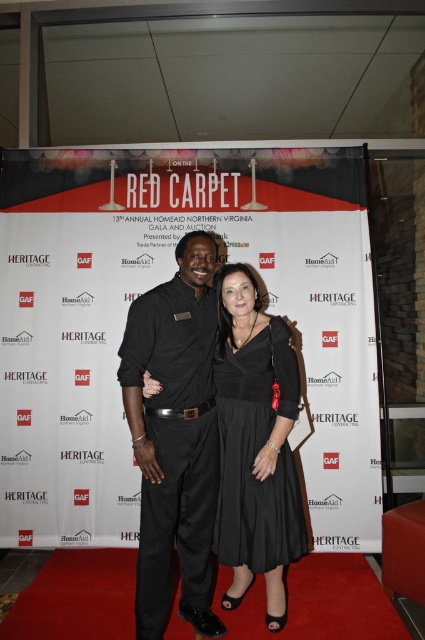
Question: From the image, what is the correct spatial relationship of black matte dress at center in relation to black satin dress at center?

Choices:
 (A) left
 (B) right

Answer: (A)

Question: Can you confirm if black matte dress at center is positioned below black satin dress at center?

Choices:
 (A) yes
 (B) no

Answer: (B)

Question: Is black matte dress at center above black satin dress at center?

Choices:
 (A) no
 (B) yes

Answer: (B)

Question: Which object appears farthest from the camera in this image?

Choices:
 (A) black matte dress at center
 (B) black satin dress at center

Answer: (B)

Question: Which point is closer to the camera?

Choices:
 (A) black satin dress at center
 (B) black matte dress at center

Answer: (B)